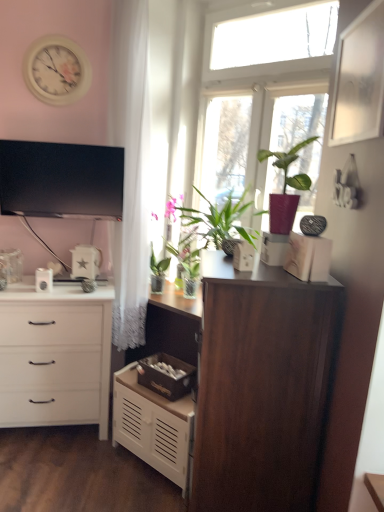
Where is `free space to the left of white matte chest of drawers at lower center, which is the 1th chest of drawers in right-to-left order`? Image resolution: width=384 pixels, height=512 pixels. free space to the left of white matte chest of drawers at lower center, which is the 1th chest of drawers in right-to-left order is located at coordinates (86, 464).